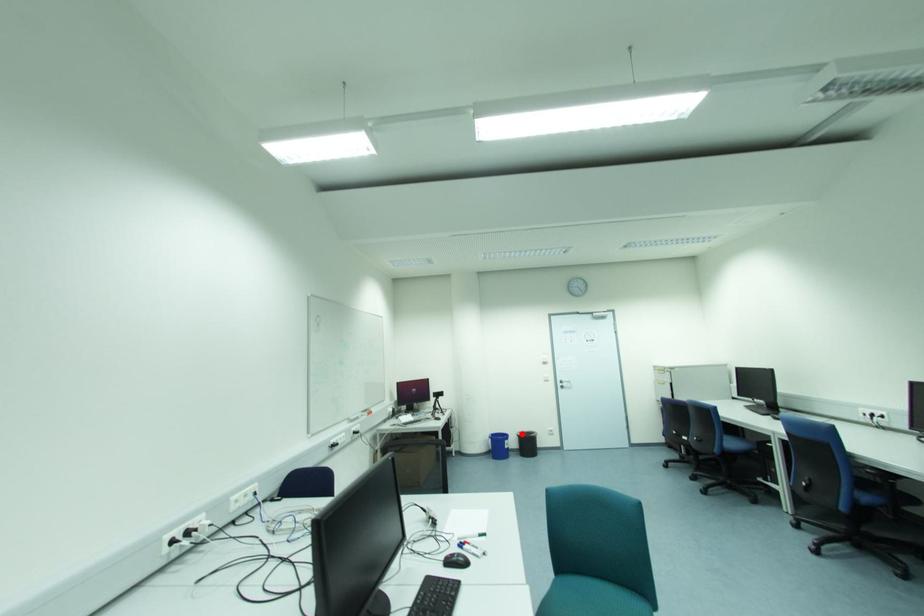
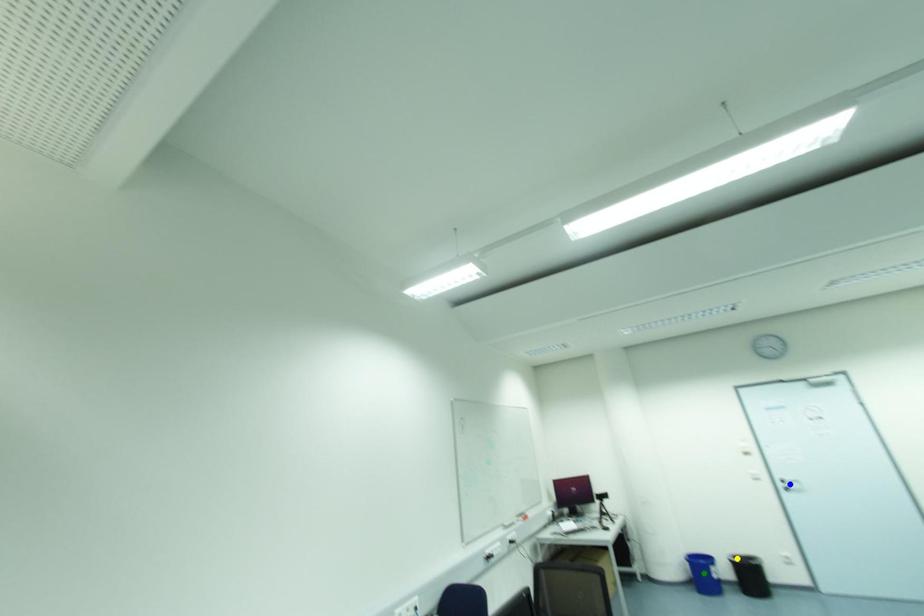
Question: I am providing you with two images of the same scene from different viewpoints. A red point is marked on the first image. You are given multiple points on the second image. Which point in image 2 represents the same 3d spot as the red point in image 1?

Choices:
 (A) green point
 (B) yellow point
 (C) blue point

Answer: (B)